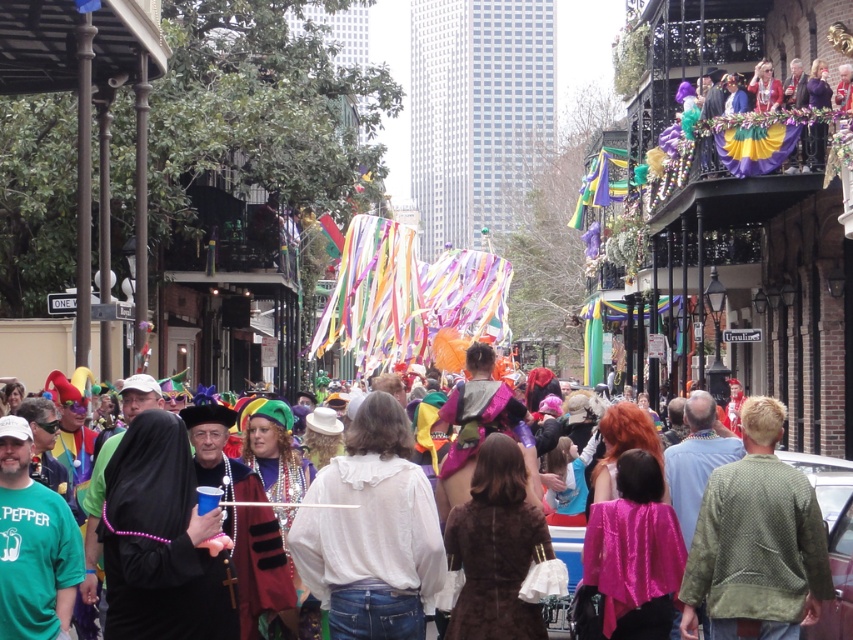
The height and width of the screenshot is (640, 853). In order to click on white cotton shirt at center in this screenshot , I will do `click(370, 531)`.

Who is higher up, white cotton shirt at center or shiny plastic cup at center?

shiny plastic cup at center is higher up.

Locate an element on the screen. white cotton shirt at center is located at coordinates (370, 531).

In order to click on white cotton shirt at center in this screenshot , I will do `click(370, 531)`.

Does white cotton shirt at center come behind camouflage-patterned jacket at center-right?

That is True.

Can you confirm if white cotton shirt at center is positioned above camouflage-patterned jacket at center-right?

Actually, white cotton shirt at center is below camouflage-patterned jacket at center-right.

The image size is (853, 640). Find the location of `white cotton shirt at center`. white cotton shirt at center is located at coordinates (370, 531).

Where is `camouflage-patterned jacket at center-right`? The width and height of the screenshot is (853, 640). camouflage-patterned jacket at center-right is located at coordinates (756, 541).